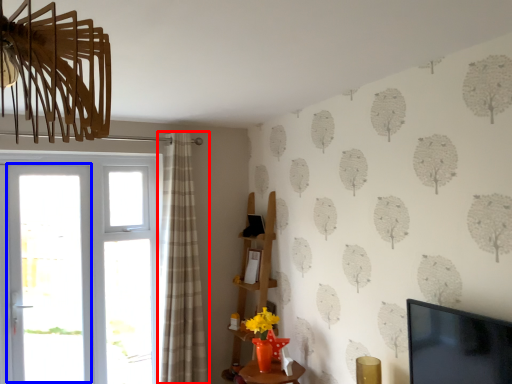
Question: Which point is further to the camera, curtain (highlighted by a red box) or screen door (highlighted by a blue box)?

Choices:
 (A) curtain
 (B) screen door

Answer: (B)